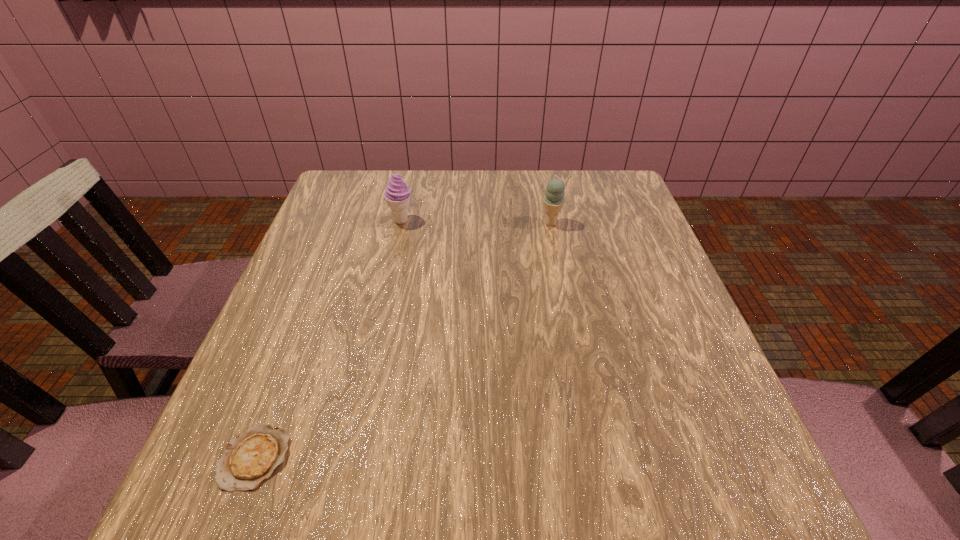
Identify the location of free spot that satisfies the following two spatial constraints: 1. on the front side of the second object from left to right; 2. on the left side of the right ice cream. This screenshot has height=540, width=960. (401, 223).